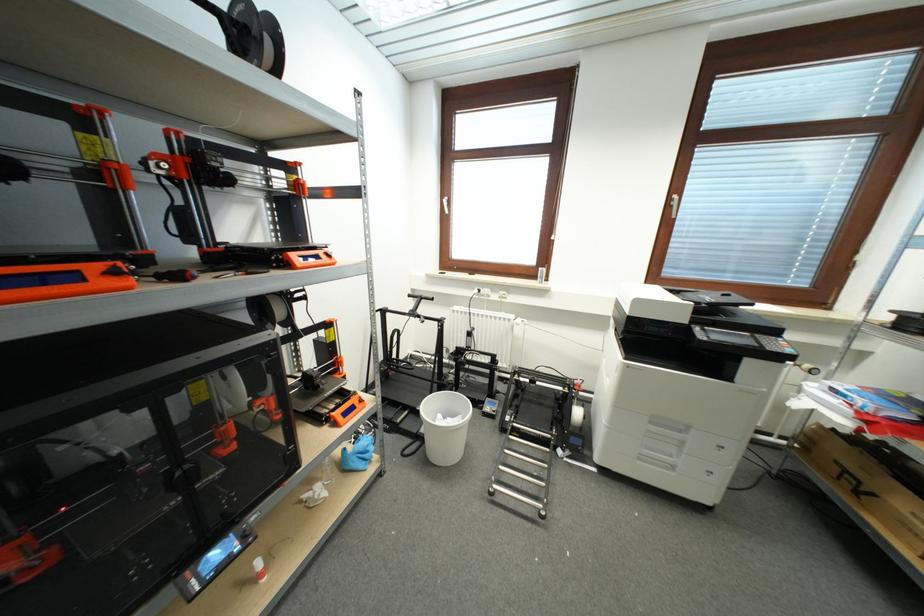
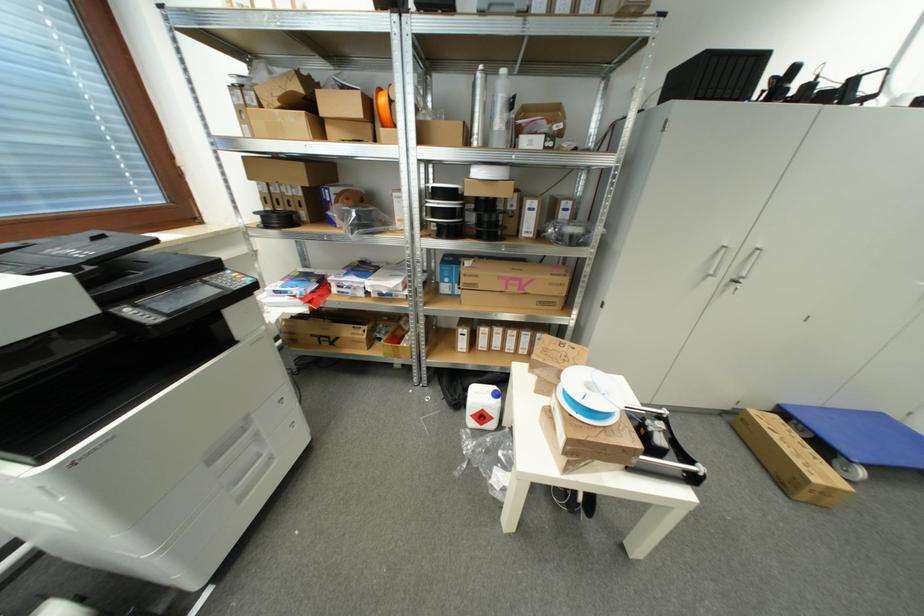
In the second image, find the point that corresponds to the point at 687,446 in the first image.

(261, 438)